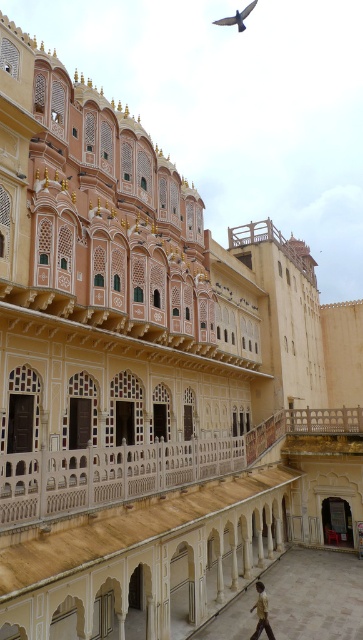
Question: Considering the relative positions of brown textured shirt at lower center and dark gray feathered bird at upper center in the image provided, where is brown textured shirt at lower center located with respect to dark gray feathered bird at upper center?

Choices:
 (A) right
 (B) left

Answer: (B)

Question: Among these objects, which one is farthest from the camera?

Choices:
 (A) brown textured shirt at lower center
 (B) dark gray feathered bird at upper center

Answer: (B)

Question: From the image, what is the correct spatial relationship of brown textured shirt at lower center in relation to dark gray feathered bird at upper center?

Choices:
 (A) below
 (B) above

Answer: (A)

Question: Does brown textured shirt at lower center appear on the right side of dark gray feathered bird at upper center?

Choices:
 (A) no
 (B) yes

Answer: (A)

Question: Which of the following is the farthest from the observer?

Choices:
 (A) dark gray feathered bird at upper center
 (B) brown textured shirt at lower center

Answer: (A)

Question: Which point is closer to the camera taking this photo?

Choices:
 (A) (229, 20)
 (B) (267, 612)

Answer: (B)